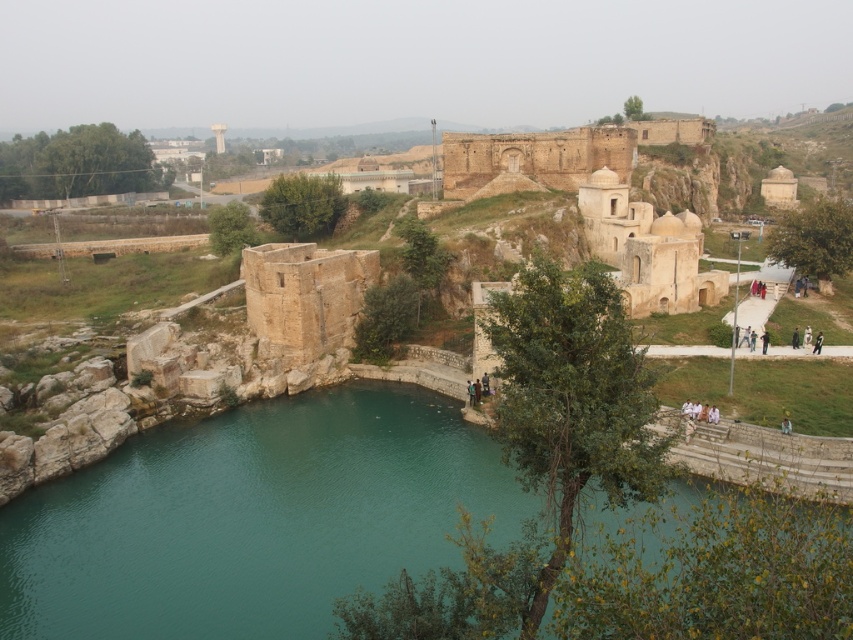
Question: In this image, where is brown stone palace at center located relative to green stone river at center?

Choices:
 (A) above
 (B) below

Answer: (A)

Question: Which point appears farthest from the camera in this image?

Choices:
 (A) (178, 492)
 (B) (593, 161)

Answer: (B)

Question: Which point is closer to the camera?

Choices:
 (A) green stone river at center
 (B) brown stone palace at center

Answer: (A)

Question: Is brown stone palace at center positioned before green stone river at center?

Choices:
 (A) no
 (B) yes

Answer: (A)

Question: Can you confirm if brown stone palace at center is positioned below green stone river at center?

Choices:
 (A) no
 (B) yes

Answer: (A)

Question: Among these objects, which one is farthest from the camera?

Choices:
 (A) brown stone palace at center
 (B) green stone river at center

Answer: (A)